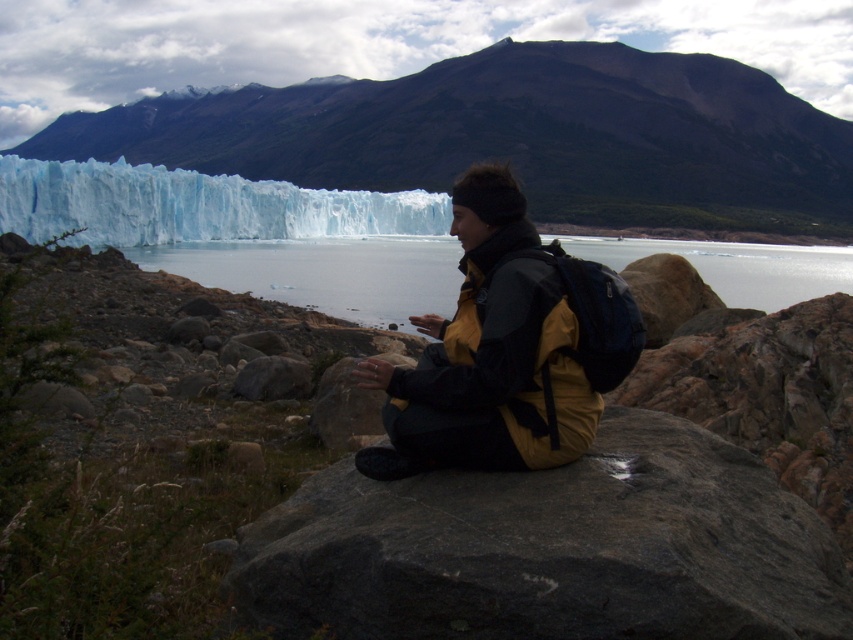
Can you confirm if gray rough rock at center is bigger than clear water at center?

No.

Is gray rough rock at center closer to camera compared to clear water at center?

Yes, it is.

Where is `gray rough rock at center`? Image resolution: width=853 pixels, height=640 pixels. gray rough rock at center is located at coordinates (552, 548).

Between gray rough rock at center and transparent ice glacier at lower left, which one is positioned lower?

gray rough rock at center is below.

Which of these two, gray rough rock at center or transparent ice glacier at lower left, stands taller?

With more height is transparent ice glacier at lower left.

Where is `gray rough rock at center`? The image size is (853, 640). gray rough rock at center is located at coordinates (552, 548).

Is gray rough rock at center bigger than yellow fabric jacket at center?

Incorrect, gray rough rock at center is not larger than yellow fabric jacket at center.

Can you confirm if gray rough rock at center is shorter than yellow fabric jacket at center?

Correct, gray rough rock at center is not as tall as yellow fabric jacket at center.

Locate an element on the screen. The height and width of the screenshot is (640, 853). gray rough rock at center is located at coordinates (552, 548).